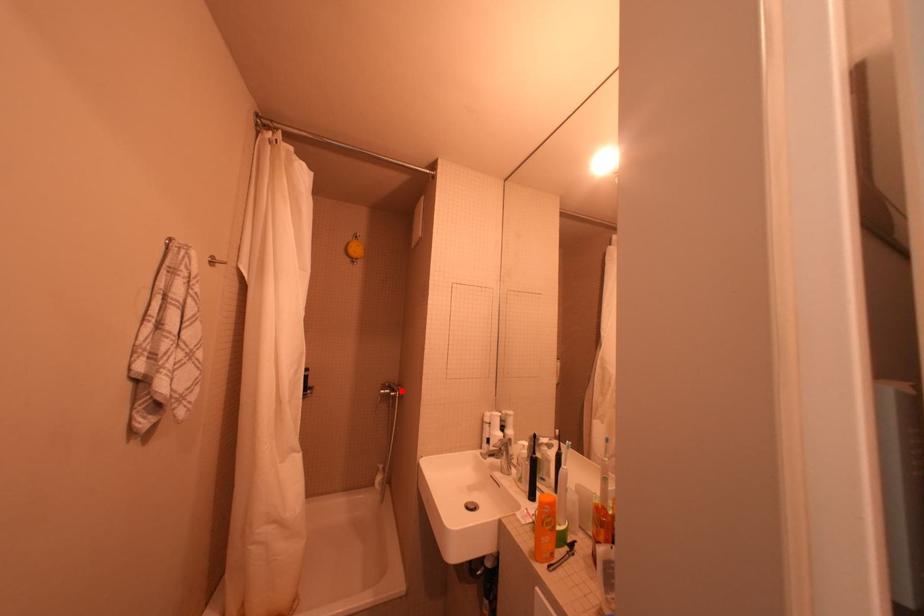
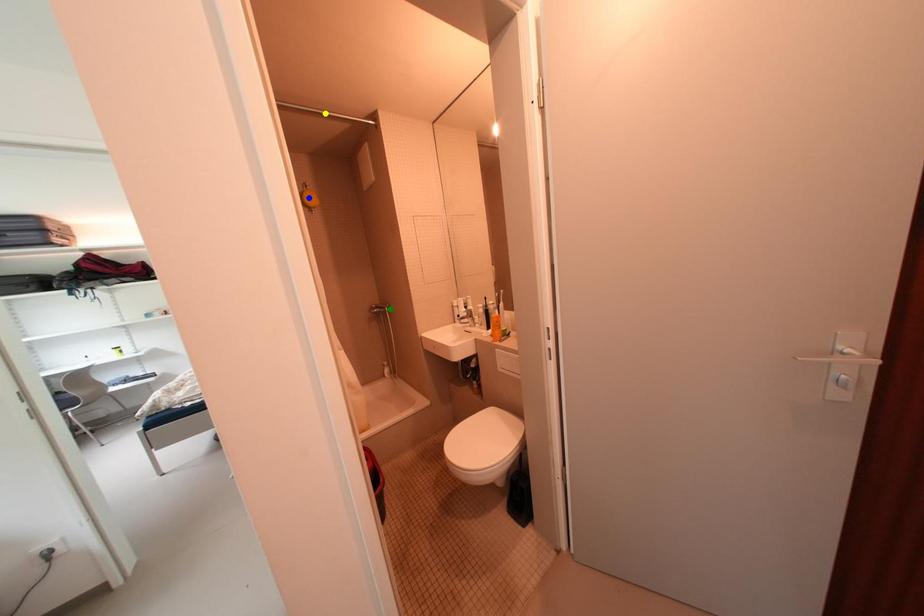
Question: I am providing you with two images of the same scene from different viewpoints. A red point is marked on the first image. You are given multiple points on the second image. Which spot in image 2 lines up with the point in image 1?

Choices:
 (A) green point
 (B) yellow point
 (C) blue point

Answer: (A)